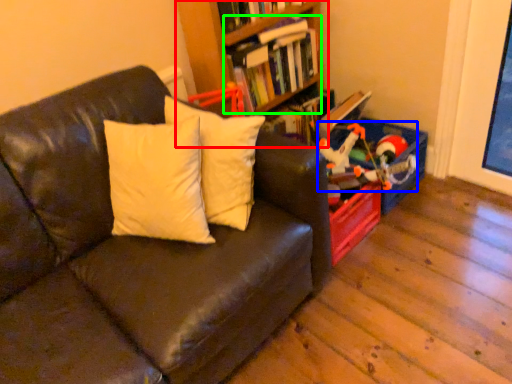
Question: Estimate the real-world distances between objects in this image. Which object is farther from bookcase (highlighted by a red box), toy (highlighted by a blue box) or book (highlighted by a green box)?

Choices:
 (A) toy
 (B) book

Answer: (A)